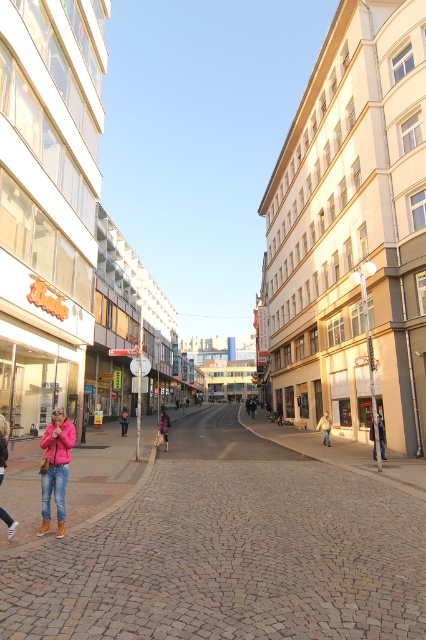
Question: Is pink fabric jacket at lower left thinner than dark blue jeans at center?

Choices:
 (A) yes
 (B) no

Answer: (A)

Question: Which point appears closest to the camera in this image?

Choices:
 (A) (123, 419)
 (B) (163, 416)
 (C) (322, 428)

Answer: (B)

Question: Does matte pink jacket at lower left lie in front of pink fabric coat at center?

Choices:
 (A) yes
 (B) no

Answer: (A)

Question: Which point appears closest to the camera in this image?

Choices:
 (A) (422, 442)
 (B) (284, 305)
 (C) (382, 428)
 (D) (161, 413)

Answer: (A)

Question: Which object appears closest to the camera in this image?

Choices:
 (A) pink fabric bag at center
 (B) pink fabric jacket at lower left
 (C) dark blue jeans at center
 (D) beige brick building at right

Answer: (B)

Question: Can you confirm if white glass mall at center is smaller than dark gray fabric jacket at right?

Choices:
 (A) no
 (B) yes

Answer: (A)